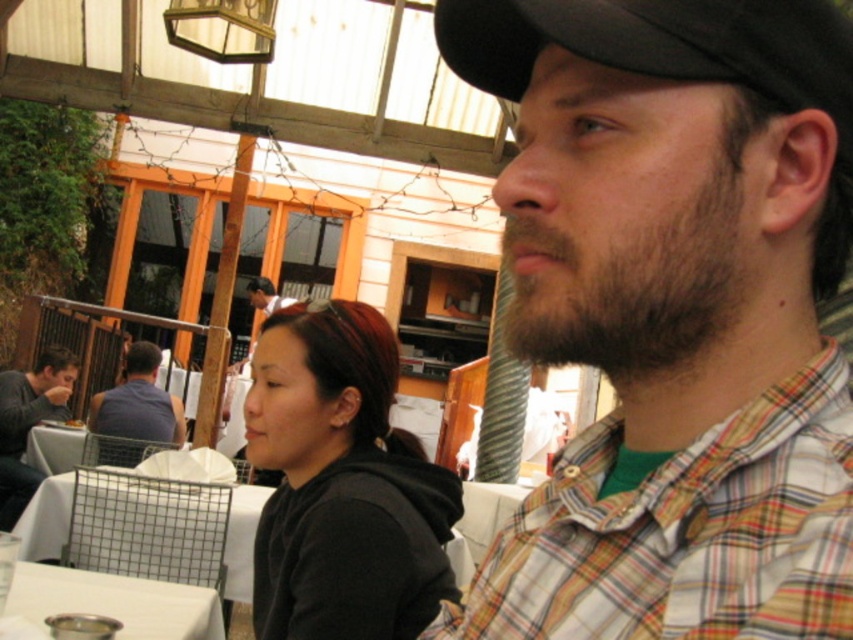
Can you confirm if black fabric cap at upper right is smaller than dark blue shirt at left?

Yes, black fabric cap at upper right is smaller than dark blue shirt at left.

The image size is (853, 640). I want to click on black fabric cap at upper right, so click(664, 45).

Find the location of a particular element. black fabric cap at upper right is located at coordinates (664, 45).

Who is higher up, matte gray sweater at left or dark blue shirt at left?

Positioned higher is dark blue shirt at left.

Which is more to the left, matte gray sweater at left or dark blue shirt at left?

From the viewer's perspective, matte gray sweater at left appears more on the left side.

I want to click on matte gray sweater at left, so click(28, 422).

The width and height of the screenshot is (853, 640). Find the location of `matte gray sweater at left`. matte gray sweater at left is located at coordinates (28, 422).

Between dark blue shirt at left and matte black shirt at center, which one appears on the right side from the viewer's perspective?

From the viewer's perspective, matte black shirt at center appears more on the right side.

Who is positioned more to the left, dark blue shirt at left or matte black shirt at center?

dark blue shirt at left is more to the left.

Does point (142, 340) come closer to viewer compared to point (267, 314)?

Yes, it is.

The image size is (853, 640). I want to click on dark blue shirt at left, so click(x=135, y=412).